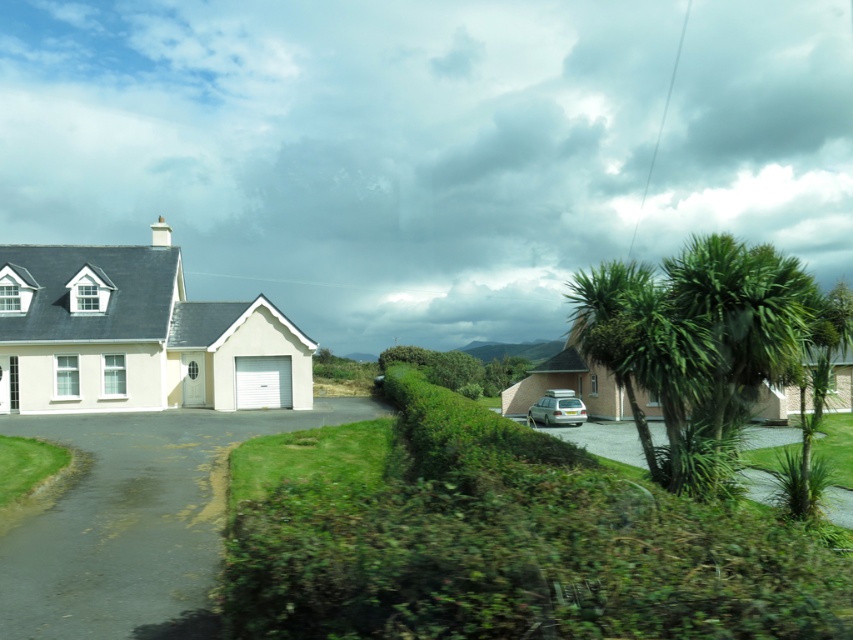
Image resolution: width=853 pixels, height=640 pixels. What do you see at coordinates (604, 440) in the screenshot?
I see `gray asphalt driveway at lower center` at bounding box center [604, 440].

Between point (619, 442) and point (560, 392), which one is positioned in front?

Positioned in front is point (619, 442).

Is point (775, 428) farther from camera compared to point (579, 412)?

No, it is not.

The height and width of the screenshot is (640, 853). In order to click on gray asphalt driveway at lower center in this screenshot , I will do `click(604, 440)`.

Can you confirm if gray asphalt driveway at lower left is positioned above green leafy palm tree at right?

No, gray asphalt driveway at lower left is not above green leafy palm tree at right.

Which is behind, point (218, 554) or point (810, 310)?

The point (810, 310) is behind.

Locate an element on the screen. The height and width of the screenshot is (640, 853). gray asphalt driveway at lower left is located at coordinates (135, 520).

This screenshot has width=853, height=640. What are the coordinates of `white matte garage at left` in the screenshot? It's located at (137, 336).

Who is higher up, white matte garage at left or green leafy palm tree at right?

white matte garage at left

Is point (122, 317) in front of point (695, 467)?

No, it is behind (695, 467).

Locate an element on the screen. white matte garage at left is located at coordinates (137, 336).